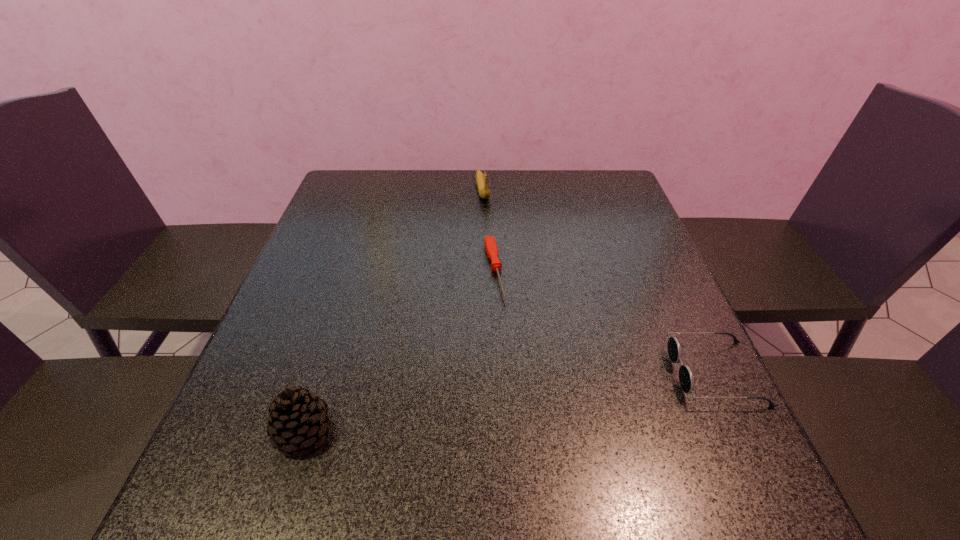
What are the coordinates of `the leftmost object` in the screenshot? It's located at (298, 419).

The image size is (960, 540). What are the coordinates of `the third tallest object` in the screenshot? It's located at (686, 378).

The width and height of the screenshot is (960, 540). Find the location of `sunglasses`. sunglasses is located at coordinates (686, 378).

Locate an element on the screen. banana is located at coordinates (481, 179).

This screenshot has width=960, height=540. I want to click on the shortest object, so click(491, 248).

Locate an element on the screen. The height and width of the screenshot is (540, 960). the second farthest object is located at coordinates (491, 248).

You are a GUI agent. You are given a task and a screenshot of the screen. Output one action in this format:
    pyautogui.click(x=<x>, y=<y>)
    Task: Click on the vacant space located at the narrow end of the leftmost object
    Image resolution: width=960 pixels, height=540 pixels.
    Given the screenshot: What is the action you would take?
    pyautogui.click(x=450, y=431)

Find the location of a particular element. Image resolution: width=960 pixels, height=540 pixels. free point located on the front-facing side of the sunglasses is located at coordinates (559, 373).

I want to click on vacant region located 0.220m on the front-facing side of the sunglasses, so click(x=559, y=373).

Where is `vacant area situated 0.250m on the front-facing side of the sunglasses`? This screenshot has width=960, height=540. vacant area situated 0.250m on the front-facing side of the sunglasses is located at coordinates (543, 373).